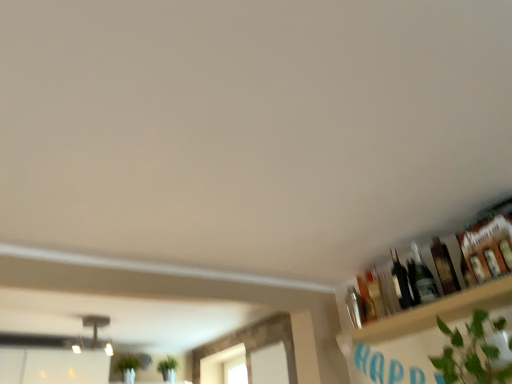
Question: Looking at their shapes, would you say shiny dark glass bottle at upper right, positioned as the 2th bottle in left-to-right order, is wider or thinner than green leafy plant at lower right?

Choices:
 (A) thin
 (B) wide

Answer: (A)

Question: In terms of height, does shiny dark glass bottle at upper right, which is counted as the third bottle, starting from the right, look taller or shorter compared to green leafy plant at lower right?

Choices:
 (A) tall
 (B) short

Answer: (A)

Question: Which object is positioned closest to the green leafy plant at lower right?

Choices:
 (A) translucent glass bottle at upper right, which ranks as the first bottle in right-to-left order
 (B) wooden shelf at upper right
 (C) metallic silver shaker at upper right, placed as the 4th bottle when sorted from right to left
 (D) shiny dark glass bottle at upper right, positioned as the 2th bottle in left-to-right order
 (E) translucent glass bottle at upper right, positioned as the 3th bottle in left-to-right order

Answer: (B)

Question: Estimate the real-world distances between objects in this image. Which object is farther from the shiny dark glass bottle at upper right, which is counted as the third bottle, starting from the right?

Choices:
 (A) translucent glass bottle at upper right, acting as the 2th bottle starting from the right
 (B) wooden shelf at upper right
 (C) green leafy plant at lower right
 (D) translucent glass bottle at upper right, which ranks as the fourth bottle in left-to-right order
 (E) metallic silver shaker at upper right, placed as the 4th bottle when sorted from right to left

Answer: (C)